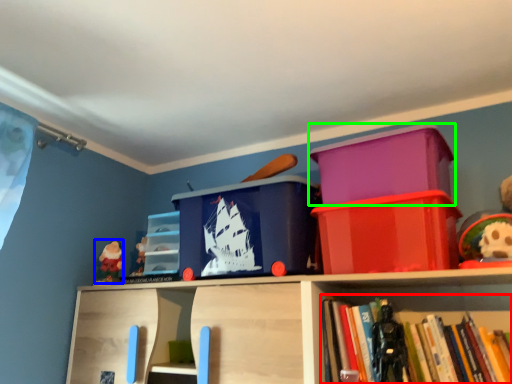
Question: Which object is the closest to the book (highlighted by a red box)? Choose among these: toy (highlighted by a blue box) or storage box (highlighted by a green box).

Choices:
 (A) toy
 (B) storage box

Answer: (B)